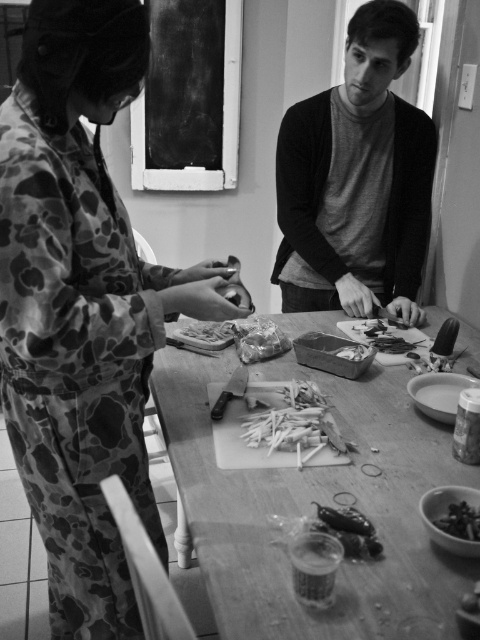
Is camo-patterned pajamas at left wider than smooth plastic bowl at lower right?

Correct, the width of camo-patterned pajamas at left exceeds that of smooth plastic bowl at lower right.

Describe the element at coordinates (83, 307) in the screenshot. I see `camo-patterned pajamas at left` at that location.

Is point (9, 424) positioned after point (471, 596)?

Yes.

Identify the location of camo-patterned pajamas at left. pos(83,307).

Between wooden cutting board at center and smooth plastic container at center, which one appears on the right side from the viewer's perspective?

From the viewer's perspective, wooden cutting board at center appears more on the right side.

Is point (264, 608) less distant than point (200, 323)?

Yes, point (264, 608) is in front of point (200, 323).

Is point (410, 611) in front of point (220, 323)?

Yes, it is.

The width and height of the screenshot is (480, 640). Identify the location of wooden cutting board at center. (310, 508).

Is dark gray sweater at center below smooth plastic container at center?

No, dark gray sweater at center is not below smooth plastic container at center.

Which is behind, point (339, 252) or point (199, 339)?

Point (339, 252)

Is point (423, 141) positioned after point (192, 333)?

Yes, it is.

Locate an element on the screen. The image size is (480, 640). dark gray sweater at center is located at coordinates (357, 179).